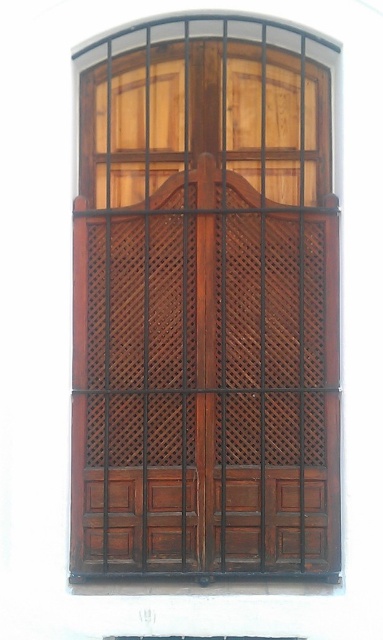
Between point (178, 550) and point (98, 579), which one is positioned in front?

Point (98, 579)

Consider the image. Can you confirm if wooden door at center is shorter than wooden at lower center?

In fact, wooden door at center may be taller than wooden at lower center.

Which is behind, point (114, 96) or point (212, 592)?

Positioned behind is point (114, 96).

Where is `wooden door at center`? This screenshot has height=640, width=383. wooden door at center is located at coordinates (204, 305).